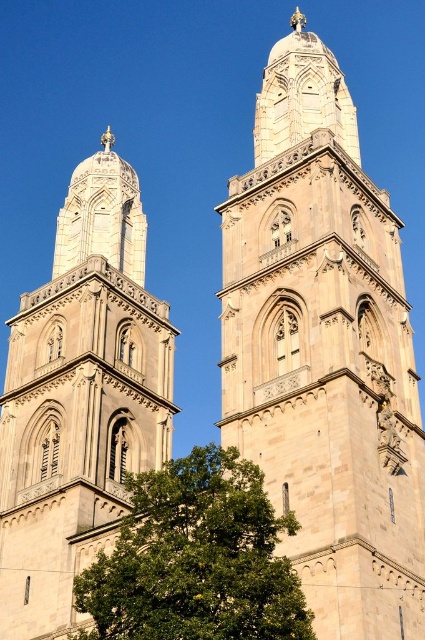
You are standing in a park and see the beige stone tower at center and the green leafy tree at lower left. Which object is located to the right of the other?

The beige stone tower at center is positioned on the right side of green leafy tree at lower left, so the beige stone tower at center is to the right of the green leafy tree at lower left.

You are an architect assessing the Grossmuenster Church in Zurich. You observe the beige stone tower at center and the green leafy tree at lower left. Which object has a greater width?

The beige stone tower at center has a greater width than the green leafy tree at lower left.

You are a tourist standing at the base of the beige stone tower at left and the green leafy tree at lower left. Which object is bigger in size?

The beige stone tower at left is larger in size than the green leafy tree at lower left.